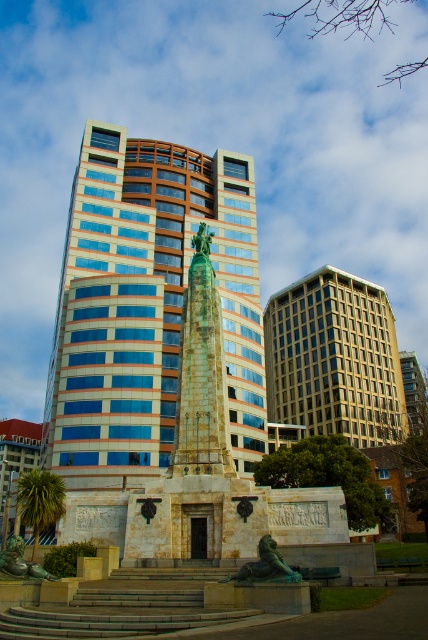
Between green patina lion at center and green patina bronze statue at center, which one is positioned higher?

Positioned higher is green patina lion at center.

Is green patina lion at center further to the viewer compared to green patina bronze statue at center?

That is False.

Who is more distant from viewer, (241, 572) or (2, 557)?

The point (2, 557) is more distant.

The image size is (428, 640). I want to click on green patina lion at center, so click(267, 564).

Is point (89, 353) positioned in front of point (17, 556)?

That is False.

Does blue glass building at center lie behind green patina bronze statue at center?

That is True.

Is point (211, 244) in front of point (32, 566)?

That is False.

Find the location of a particular element. This screenshot has height=640, width=428. blue glass building at center is located at coordinates (146, 307).

How much distance is there between blue glass building at center and green patina lion at center?

blue glass building at center and green patina lion at center are 57.36 meters apart.

What do you see at coordinates (146, 307) in the screenshot? I see `blue glass building at center` at bounding box center [146, 307].

Which is in front, point (127, 387) or point (267, 564)?

Point (267, 564)

Find the location of a particular element. The image size is (428, 640). blue glass building at center is located at coordinates (146, 307).